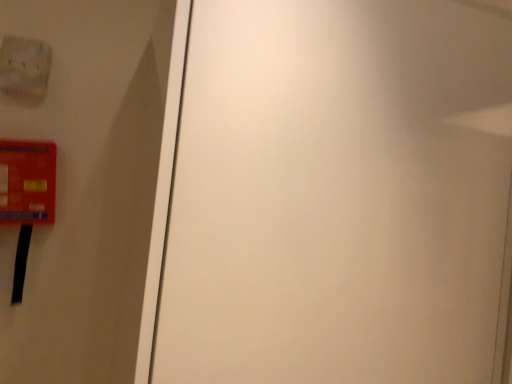
In the scene shown: Measure the distance between white matte door at center and camera.

22.33 inches.

Where is `white matte door at center`? The image size is (512, 384). white matte door at center is located at coordinates (339, 194).

What do you see at coordinates (339, 194) in the screenshot? I see `white matte door at center` at bounding box center [339, 194].

Find the location of `white matte door at center`. white matte door at center is located at coordinates (339, 194).